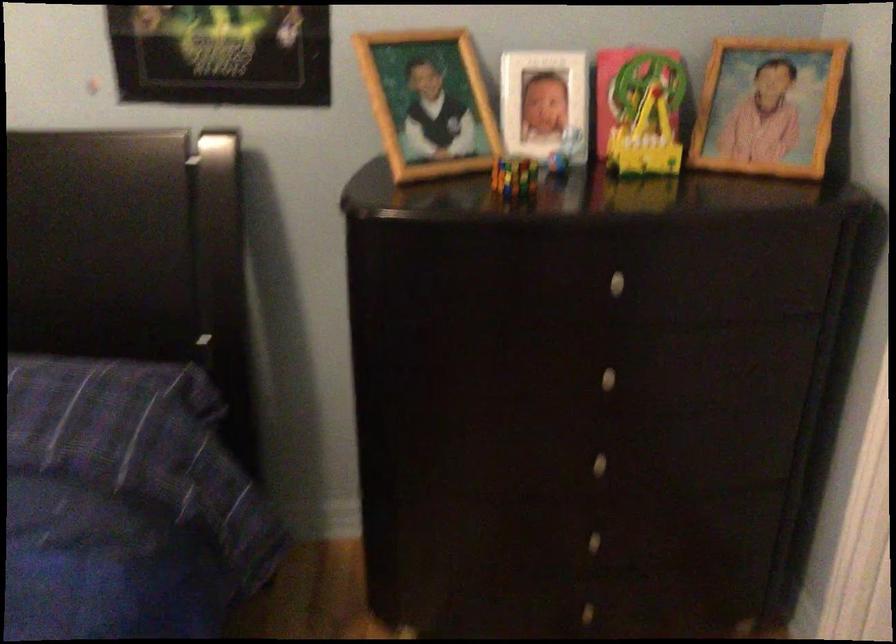
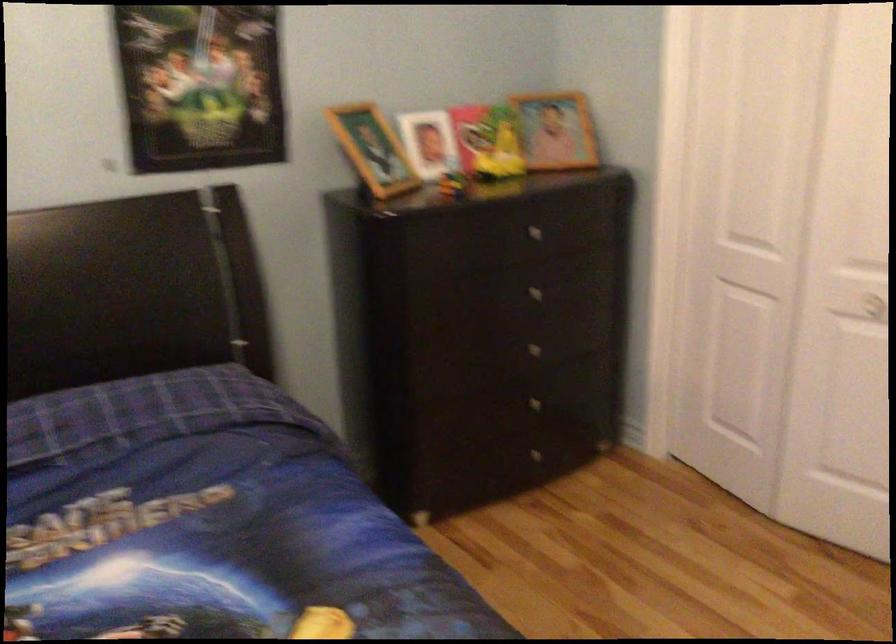
Locate, in the second image, the point that corresponds to [431,113] in the first image.

(373, 149)